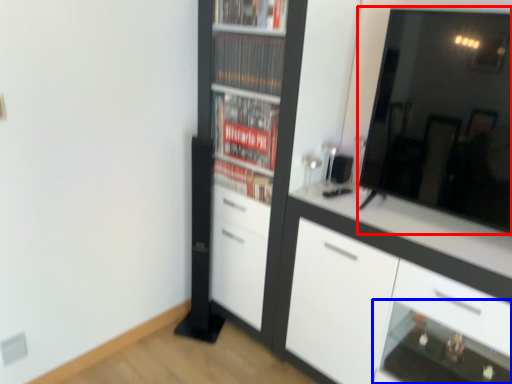
Question: Which object appears closest to the camera in this image, mirror (highlighted by a red box) or shelf (highlighted by a blue box)?

Choices:
 (A) mirror
 (B) shelf

Answer: (A)